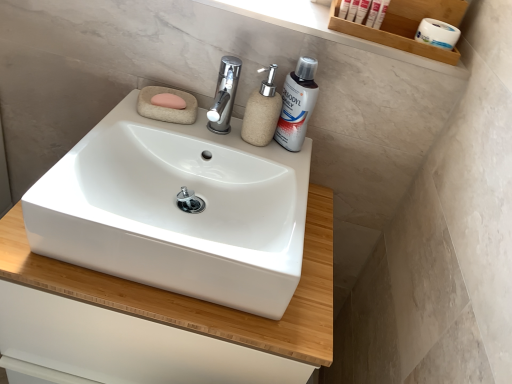
Question: From a real-world perspective, does white plastic tubes at upper right, marked as the 2th personal care in a right-to-left arrangement, sit lower than wooden shelf at upper right?

Choices:
 (A) no
 (B) yes

Answer: (B)

Question: Considering the relative sizes of white plastic tubes at upper right, marked as the 2th personal care in a right-to-left arrangement, and wooden shelf at upper right in the image provided, is white plastic tubes at upper right, marked as the 2th personal care in a right-to-left arrangement, taller than wooden shelf at upper right?

Choices:
 (A) yes
 (B) no

Answer: (B)

Question: From a real-world perspective, is white plastic tubes at upper right, marked as the 2th personal care in a right-to-left arrangement, on top of wooden shelf at upper right?

Choices:
 (A) no
 (B) yes

Answer: (A)

Question: Is white plastic tubes at upper right, marked as the 2th personal care in a right-to-left arrangement, to the right of wooden shelf at upper right from the viewer's perspective?

Choices:
 (A) yes
 (B) no

Answer: (B)

Question: From the image's perspective, would you say white plastic tubes at upper right, which is the 1th personal care in left-to-right order, is positioned over wooden shelf at upper right?

Choices:
 (A) no
 (B) yes

Answer: (B)

Question: Is white plastic tube at upper right to the right of white plastic tubes at upper right, which is the 1th personal care in left-to-right order, from the viewer's perspective?

Choices:
 (A) no
 (B) yes

Answer: (A)

Question: From the image's perspective, does white plastic tube at upper right appear lower than white plastic tubes at upper right, which is the 1th personal care in left-to-right order?

Choices:
 (A) yes
 (B) no

Answer: (B)

Question: Is white plastic tube at upper right positioned before white plastic tubes at upper right, which is the 1th personal care in left-to-right order?

Choices:
 (A) yes
 (B) no

Answer: (A)

Question: Would you consider white plastic tube at upper right to be distant from white plastic tubes at upper right, which is the 1th personal care in left-to-right order?

Choices:
 (A) yes
 (B) no

Answer: (B)

Question: Is white plastic tube at upper right outside of white plastic tubes at upper right, marked as the 2th personal care in a right-to-left arrangement?

Choices:
 (A) no
 (B) yes

Answer: (B)

Question: Is white plastic tube at upper right bigger than white plastic tubes at upper right, marked as the 2th personal care in a right-to-left arrangement?

Choices:
 (A) yes
 (B) no

Answer: (A)

Question: Can you confirm if wooden shelf at upper right is smaller than white plastic toothpaste at upper right, the first personal care from the right?

Choices:
 (A) no
 (B) yes

Answer: (A)